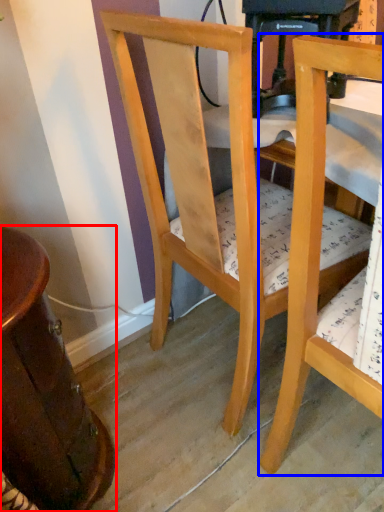
Question: Among these objects, which one is farthest to the camera, table (highlighted by a red box) or chair (highlighted by a blue box)?

Choices:
 (A) table
 (B) chair

Answer: (A)